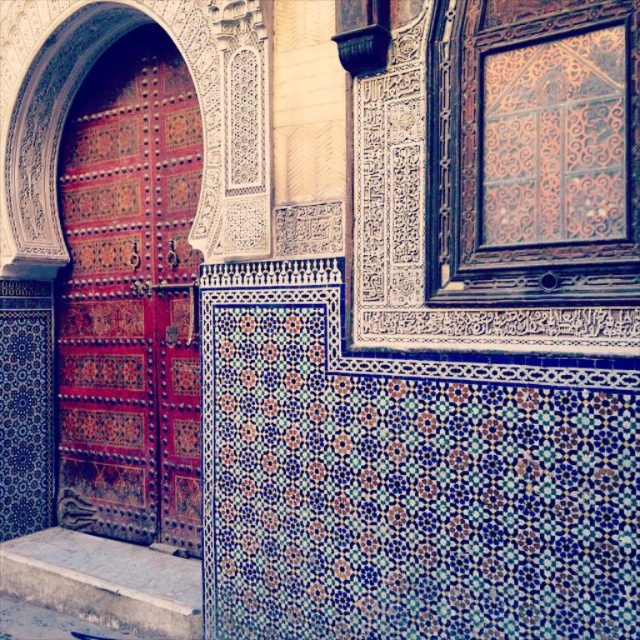
Question: Which point is farther from the camera taking this photo?

Choices:
 (A) (83, 221)
 (B) (188, 616)

Answer: (A)

Question: Among these points, which one is nearest to the camera?

Choices:
 (A) (150, 368)
 (B) (173, 605)

Answer: (B)

Question: Is polished wood door at left wider than smooth stone step at lower left?

Choices:
 (A) no
 (B) yes

Answer: (A)

Question: Does polished wood door at left lie behind smooth stone step at lower left?

Choices:
 (A) no
 (B) yes

Answer: (B)

Question: Is polished wood door at left positioned before smooth stone step at lower left?

Choices:
 (A) yes
 (B) no

Answer: (B)

Question: Which of the following is the farthest from the observer?

Choices:
 (A) smooth stone step at lower left
 (B) polished wood door at left

Answer: (B)